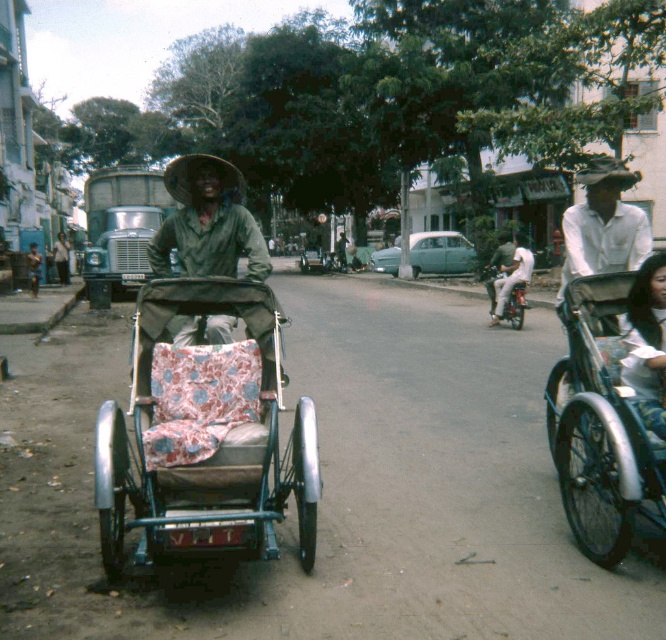
Question: Can you confirm if metallic silver tricycle at right is positioned to the right of white cotton shirt at right?

Choices:
 (A) yes
 (B) no

Answer: (B)

Question: Can you confirm if patterned fabric baby carriage at left is positioned below white cotton shirt at right?

Choices:
 (A) no
 (B) yes

Answer: (B)

Question: Can you confirm if metallic silver tricycle at right is bigger than white cotton shirt at right?

Choices:
 (A) no
 (B) yes

Answer: (A)

Question: Considering the real-world distances, which object is closest to the patterned fabric baby carriage at left?

Choices:
 (A) patterned fabric tricycle at center
 (B) metallic silver motorcycle at center-right
 (C) green fabric hat at center

Answer: (C)

Question: Which object appears farthest from the camera in this image?

Choices:
 (A) patterned fabric tricycle at center
 (B) patterned fabric baby carriage at left

Answer: (A)

Question: Among these objects, which one is farthest from the camera?

Choices:
 (A) white fabric shirt at center
 (B) patterned fabric tricycle at center
 (C) metallic silver tricycle at right

Answer: (B)